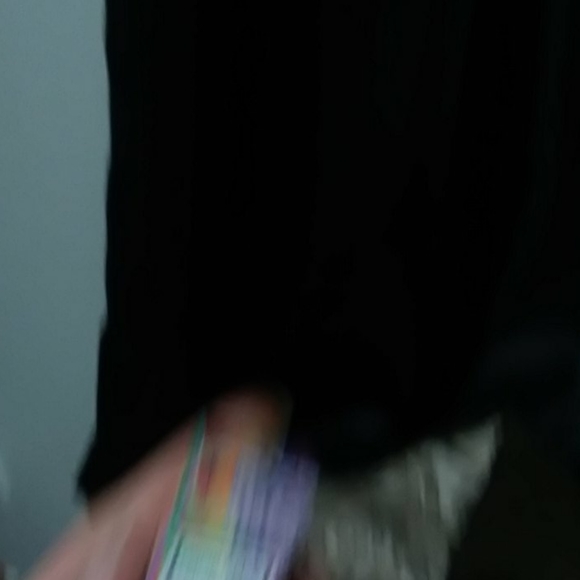
This screenshot has height=580, width=580. I want to click on wall, so click(x=75, y=176).